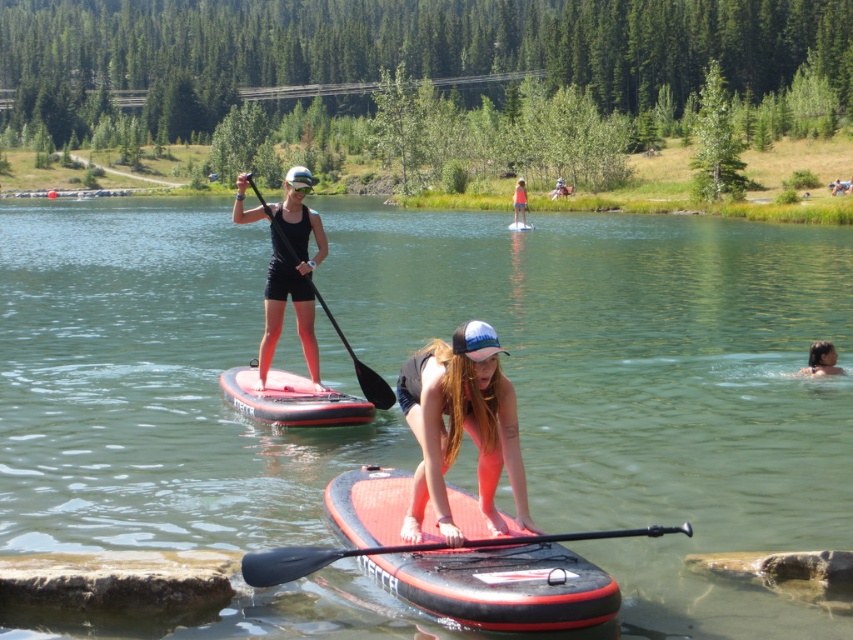
Looking at this image, you are a photographer trying to capture the paddleboarders. You have a camera with a limited field of view. Which object, the red rubber paddleboard at center or the black matte paddle at upper center, will fit entirely within your camera frame if you focus on the center of the scene?

The red rubber paddleboard at center occupies less space than the black matte paddle at upper center, so it will fit entirely within the camera frame when focusing on the center of the scene.

You are looking at the image of the lake scene. There are two points marked in the image. The first point is at coordinates point (483, 616) and the second is at point (799, 372). Which point is closer to you?

Point (483, 616) is closer to the camera than point (799, 372).